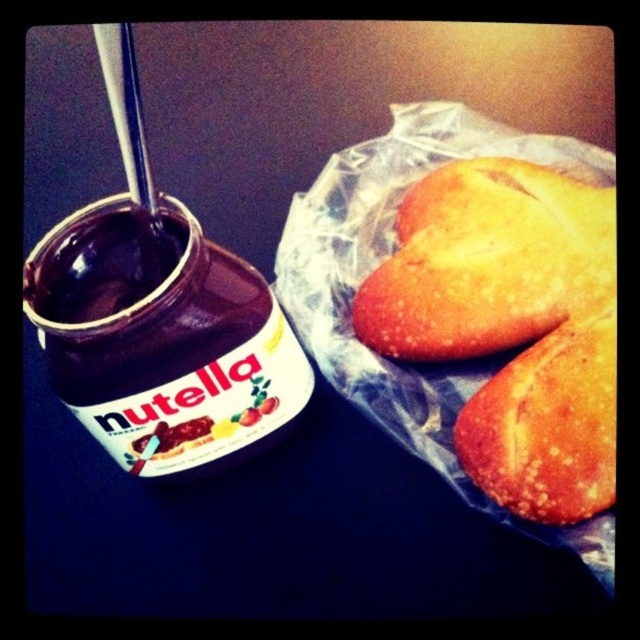
Question: Which object appears closest to the camera in this image?

Choices:
 (A) golden crusty bread at right
 (B) golden crispy bread at upper right

Answer: (A)

Question: Does golden crispy bread at upper right lie in front of golden crusty bread at right?

Choices:
 (A) yes
 (B) no

Answer: (B)

Question: Which point appears farthest from the camera in this image?

Choices:
 (A) (570, 408)
 (B) (576, 289)

Answer: (B)

Question: Observing the image, what is the correct spatial positioning of golden crispy bread at upper right in reference to golden crusty bread at right?

Choices:
 (A) below
 (B) above

Answer: (B)

Question: Can you confirm if golden crispy bread at upper right is bigger than golden crusty bread at right?

Choices:
 (A) no
 (B) yes

Answer: (B)

Question: Among these objects, which one is farthest from the camera?

Choices:
 (A) golden crispy bread at upper right
 (B) golden crusty bread at right

Answer: (A)